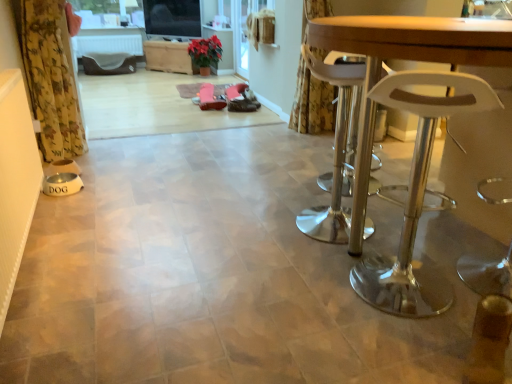
Question: Is green matte plant at center shorter than transparent glass screen door at upper center?

Choices:
 (A) yes
 (B) no

Answer: (A)

Question: Is green matte plant at center bigger than transparent glass screen door at upper center?

Choices:
 (A) no
 (B) yes

Answer: (B)

Question: Is green matte plant at center thinner than transparent glass screen door at upper center?

Choices:
 (A) yes
 (B) no

Answer: (B)

Question: Can you confirm if green matte plant at center is smaller than transparent glass screen door at upper center?

Choices:
 (A) yes
 (B) no

Answer: (B)

Question: From a real-world perspective, is green matte plant at center physically above transparent glass screen door at upper center?

Choices:
 (A) no
 (B) yes

Answer: (A)

Question: From the image's perspective, would you say green matte plant at center is shown under transparent glass screen door at upper center?

Choices:
 (A) no
 (B) yes

Answer: (B)

Question: Is clear plastic stool at right oriented towards yellow floral fabric curtain at left, the 1th curtain in the front-to-back sequence?

Choices:
 (A) no
 (B) yes

Answer: (A)

Question: Does clear plastic stool at right have a greater width compared to yellow floral fabric curtain at left, which ranks as the 2th curtain in back-to-front order?

Choices:
 (A) no
 (B) yes

Answer: (B)

Question: From a real-world perspective, is clear plastic stool at right physically below yellow floral fabric curtain at left, arranged as the second curtain when viewed from the right?

Choices:
 (A) no
 (B) yes

Answer: (B)

Question: Does clear plastic stool at right have a larger size compared to yellow floral fabric curtain at left, marked as the first curtain in a left-to-right arrangement?

Choices:
 (A) yes
 (B) no

Answer: (B)

Question: Is clear plastic stool at right outside yellow floral fabric curtain at left, arranged as the second curtain when viewed from the right?

Choices:
 (A) no
 (B) yes

Answer: (B)

Question: Considering the relative sizes of clear plastic stool at right and yellow floral fabric curtain at left, which ranks as the 2th curtain in back-to-front order, in the image provided, is clear plastic stool at right thinner than yellow floral fabric curtain at left, which ranks as the 2th curtain in back-to-front order,?

Choices:
 (A) yes
 (B) no

Answer: (B)

Question: Does wooden table at right have a greater height compared to transparent glass screen door at upper center?

Choices:
 (A) no
 (B) yes

Answer: (A)